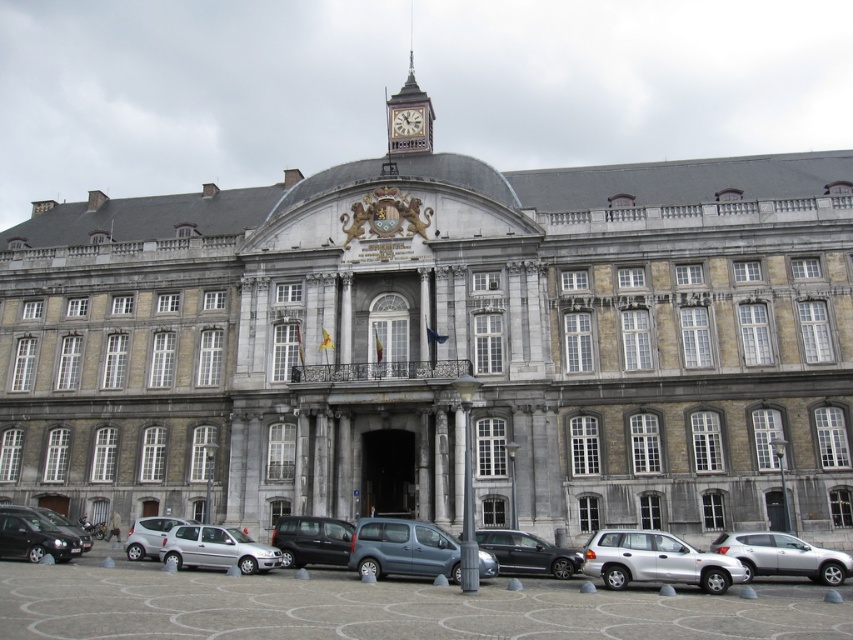
Question: Is metallic gray van at center bigger than silver metallic car at lower right?

Choices:
 (A) no
 (B) yes

Answer: (A)

Question: Can you confirm if metallic gray van at center is bigger than matte black van at center?

Choices:
 (A) yes
 (B) no

Answer: (B)

Question: Which object is closer to the camera taking this photo?

Choices:
 (A) matte black car at lower left
 (B) silver metallic car at lower right
 (C) silver metallic hatchback at lower left
 (D) metallic gray van at center

Answer: (B)

Question: Among these objects, which one is nearest to the camera?

Choices:
 (A) silver metallic car at lower center
 (B) silver metallic hatchback at lower left

Answer: (A)

Question: Is silver metallic car at lower right below matte black van at center?

Choices:
 (A) yes
 (B) no

Answer: (B)

Question: Which point appears closest to the camera in this image?

Choices:
 (A) (412, 122)
 (B) (503, 566)

Answer: (B)